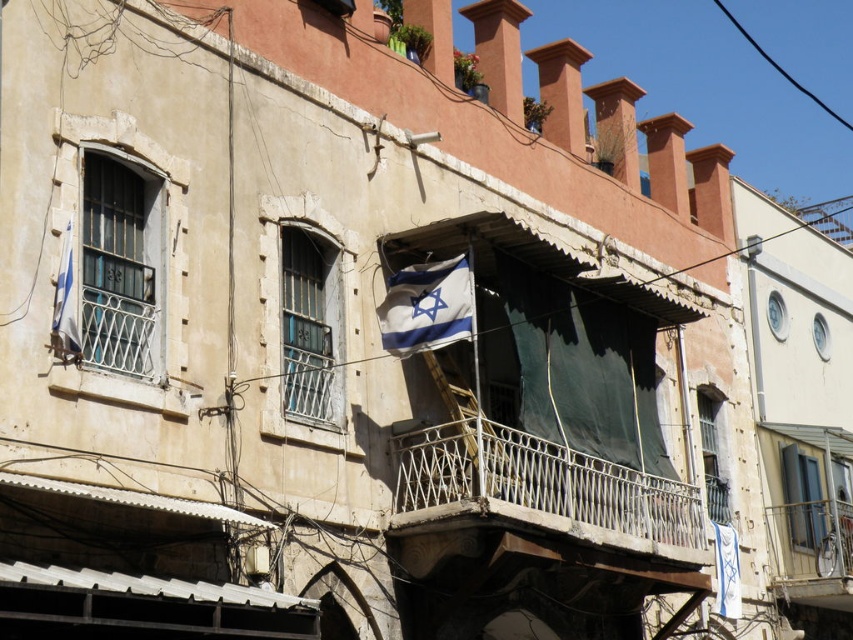
Between point (447, 428) and point (451, 276), which one is positioned in front?

Positioned in front is point (451, 276).

Which is more to the right, metallic white balcony at center or blue fabric flag at center?

Positioned to the right is metallic white balcony at center.

This screenshot has height=640, width=853. Describe the element at coordinates (541, 490) in the screenshot. I see `metallic white balcony at center` at that location.

The width and height of the screenshot is (853, 640). Identify the location of metallic white balcony at center. (541, 490).

Is metallic white balcony at center shorter than blue-white fabric flag at left?

No, metallic white balcony at center is not shorter than blue-white fabric flag at left.

Which is more to the left, metallic white balcony at center or blue-white fabric flag at left?

blue-white fabric flag at left is more to the left.

Image resolution: width=853 pixels, height=640 pixels. In order to click on metallic white balcony at center in this screenshot , I will do `click(541, 490)`.

The width and height of the screenshot is (853, 640). In order to click on metallic white balcony at center in this screenshot , I will do `click(541, 490)`.

Is blue fabric flag at center taller than blue-white fabric flag at left?

In fact, blue fabric flag at center may be shorter than blue-white fabric flag at left.

Is blue fabric flag at center smaller than blue-white fabric flag at left?

No, blue fabric flag at center is not smaller than blue-white fabric flag at left.

Which is behind, point (389, 301) or point (67, 324)?

The point (389, 301) is more distant.

The image size is (853, 640). What are the coordinates of `blue fabric flag at center` in the screenshot? It's located at (428, 307).